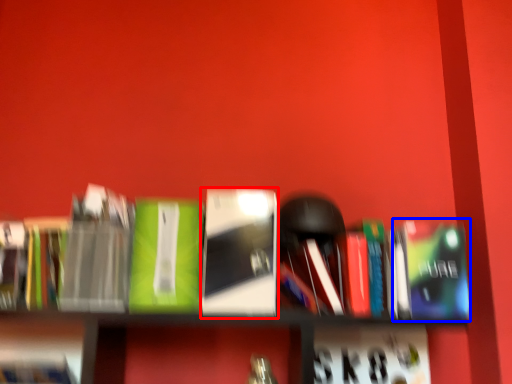
Question: Which of the following is the closest to the observer, book (highlighted by a red box) or paperback book (highlighted by a blue box)?

Choices:
 (A) book
 (B) paperback book

Answer: (A)